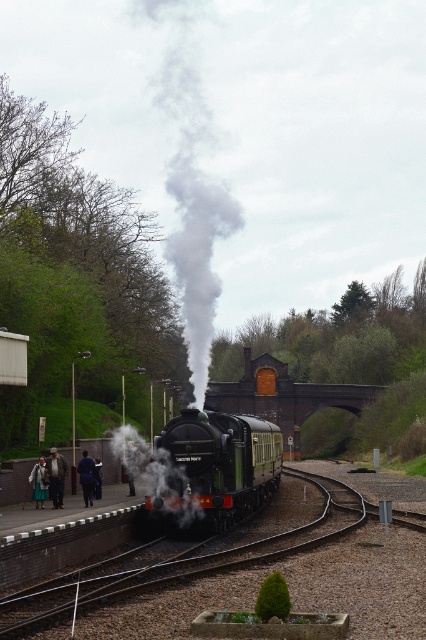
Question: Which point appears closest to the camera in this image?

Choices:
 (A) (54, 449)
 (B) (192, 129)

Answer: (A)

Question: Which of the following is the farthest from the observer?

Choices:
 (A) light blue denim jacket at left
 (B) light brown leather coat at lower left
 (C) gray/smoke-like steam at center
 (D) dark blue coat at lower left

Answer: (A)

Question: Does gray/smoke-like steam at center appear on the left side of dark blue coat at lower left?

Choices:
 (A) yes
 (B) no

Answer: (B)

Question: Which point appears farthest from the camera in this image?

Choices:
 (A) coord(89,477)
 (B) coord(63,486)
 (C) coord(29,476)
 (D) coord(193,67)

Answer: (D)

Question: Can you confirm if light brown leather coat at lower left is thinner than dark blue coat at lower left?

Choices:
 (A) no
 (B) yes

Answer: (A)

Question: Observing the image, what is the correct spatial positioning of gray/smoke-like steam at center in reference to light brown leather coat at lower left?

Choices:
 (A) above
 (B) below

Answer: (A)